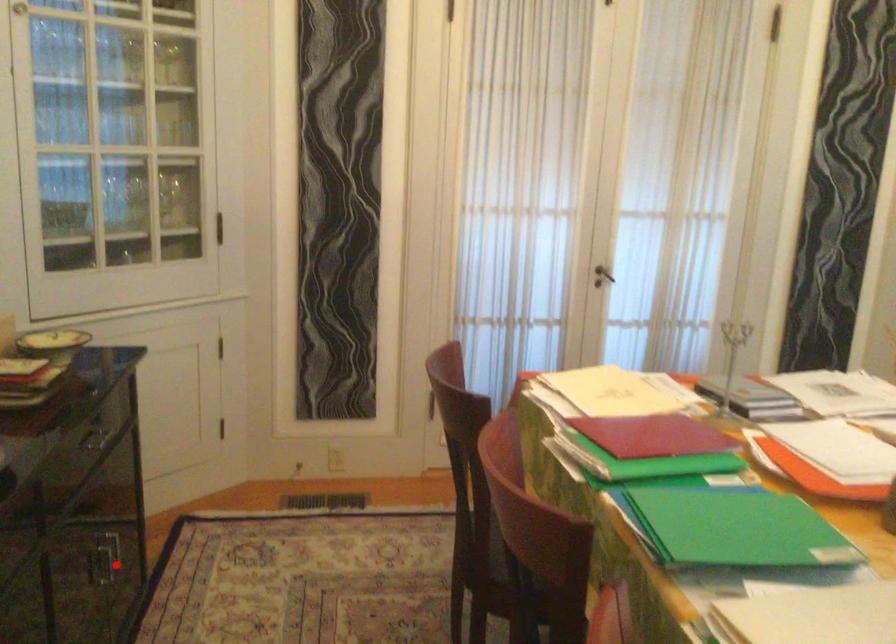
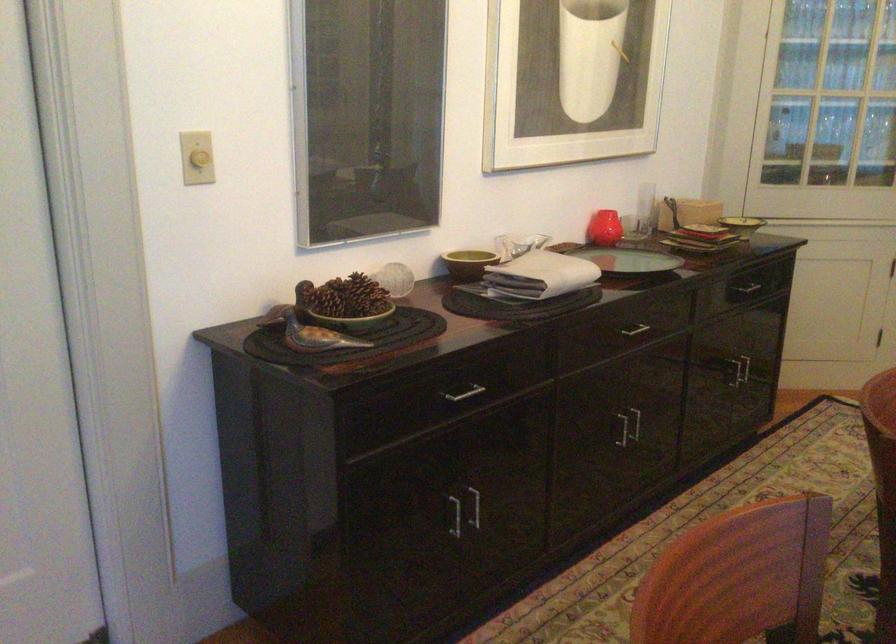
Locate, in the second image, the point that corresponds to the highlighted location in the first image.

(737, 371)